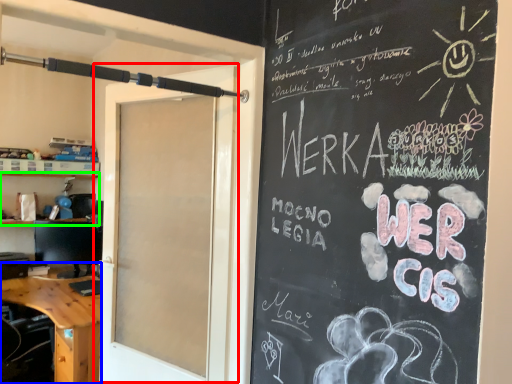
Question: Which object is positioned closest to door (highlighted by a red box)? Select from desk (highlighted by a blue box) and shelf (highlighted by a green box).

Choices:
 (A) desk
 (B) shelf

Answer: (A)